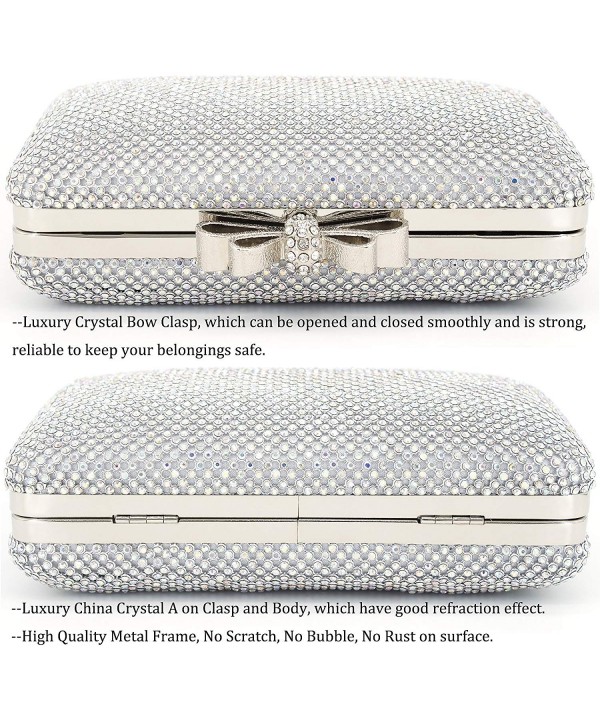
I want to click on right hinge, so click(x=452, y=521).